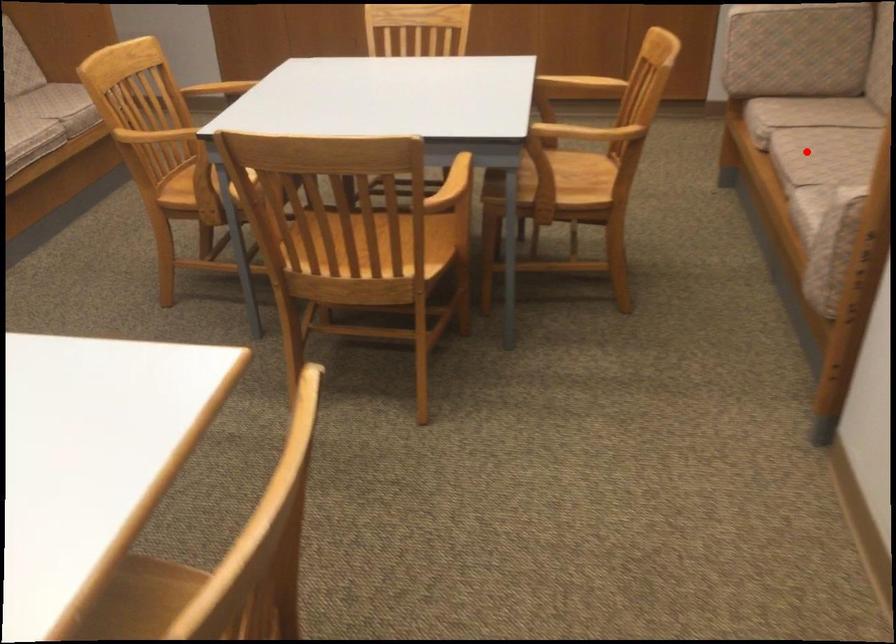
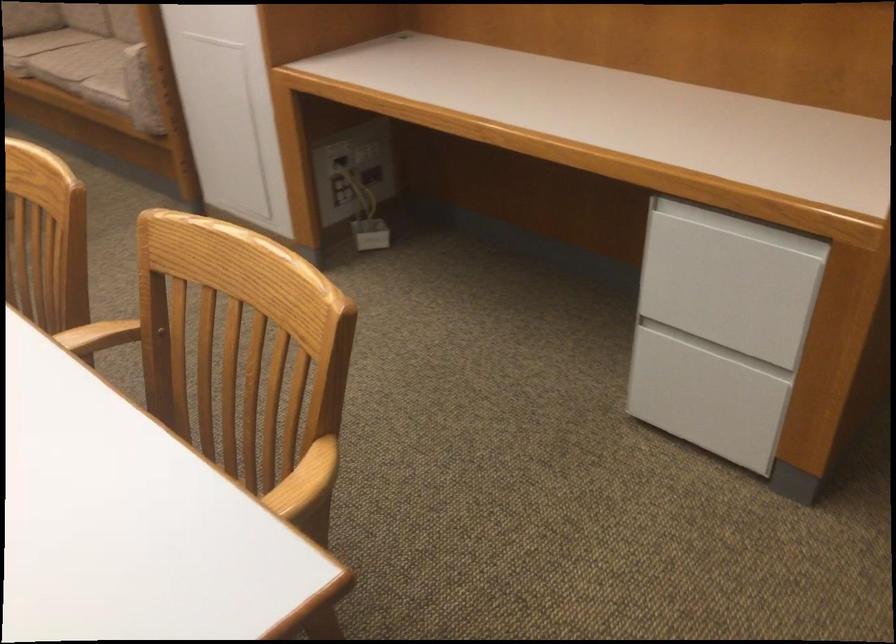
The point at the highlighted location is marked in the first image. Where is the corresponding point in the second image?

(76, 61)